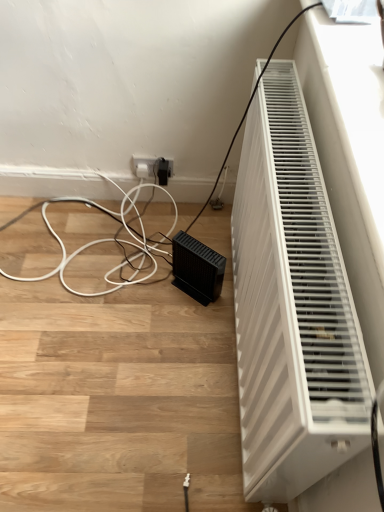
Question: In terms of size, does black matte speaker at lower center appear bigger or smaller than white plastic radiator at right?

Choices:
 (A) small
 (B) big

Answer: (A)

Question: From a real-world perspective, is black matte speaker at lower center positioned above or below white plastic radiator at right?

Choices:
 (A) below
 (B) above

Answer: (A)

Question: Considering the positions of black matte speaker at lower center and white plastic radiator at right in the image, is black matte speaker at lower center taller or shorter than white plastic radiator at right?

Choices:
 (A) short
 (B) tall

Answer: (A)

Question: In terms of height, does white plastic radiator at right look taller or shorter compared to black matte speaker at lower center?

Choices:
 (A) tall
 (B) short

Answer: (A)

Question: From a real-world perspective, is white plastic radiator at right physically located above or below black matte speaker at lower center?

Choices:
 (A) below
 (B) above

Answer: (B)

Question: In terms of size, does white plastic radiator at right appear bigger or smaller than black matte speaker at lower center?

Choices:
 (A) big
 (B) small

Answer: (A)

Question: Does point (329, 460) appear closer or farther from the camera than point (193, 270)?

Choices:
 (A) closer
 (B) farther

Answer: (A)